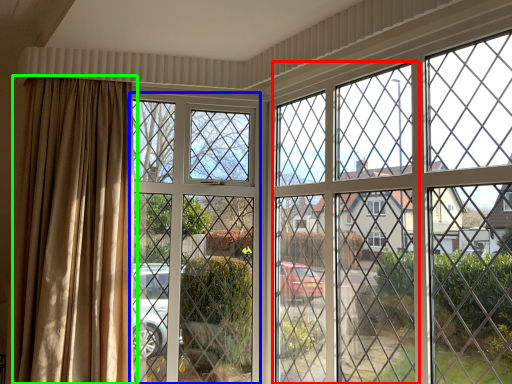
Question: Which object is the farthest from screen door (highlighted by a red box)? Choose among these: screen door (highlighted by a blue box) or curtain (highlighted by a green box).

Choices:
 (A) screen door
 (B) curtain

Answer: (B)